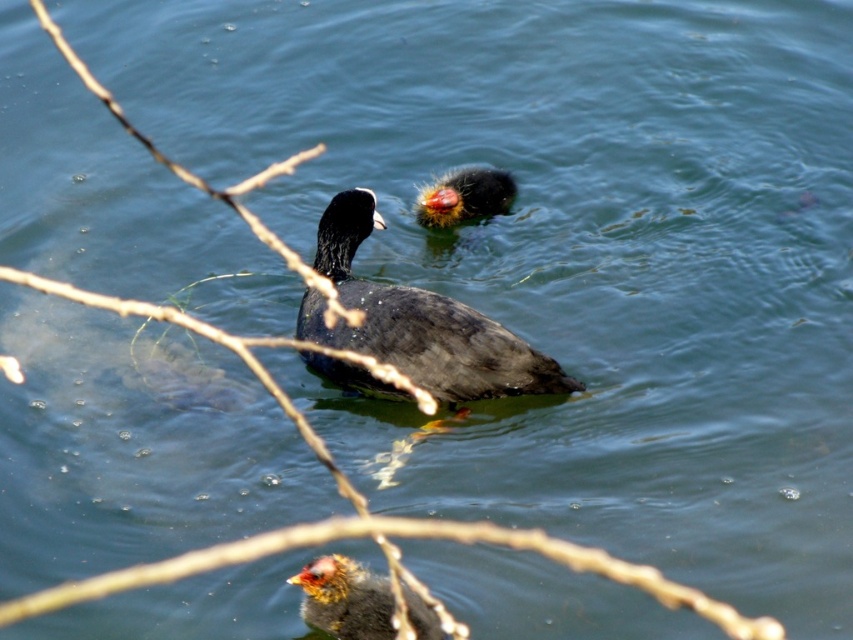
Question: Is matte black duck at center further to the viewer compared to fluffy black duckling at upper center?

Choices:
 (A) no
 (B) yes

Answer: (A)

Question: Which object is closer to the camera taking this photo?

Choices:
 (A) brown fuzzy duckling at lower center
 (B) matte black duck at center

Answer: (A)

Question: Among these points, which one is farthest from the camera?

Choices:
 (A) (509, 173)
 (B) (315, 579)
 (C) (517, 388)

Answer: (A)

Question: Is brown fuzzy duckling at lower center bigger than fluffy black duckling at upper center?

Choices:
 (A) yes
 (B) no

Answer: (A)

Question: Does matte black duck at center come in front of fluffy black duckling at upper center?

Choices:
 (A) yes
 (B) no

Answer: (A)

Question: Which point appears farthest from the camera in this image?

Choices:
 (A) (368, 632)
 (B) (370, 324)

Answer: (B)